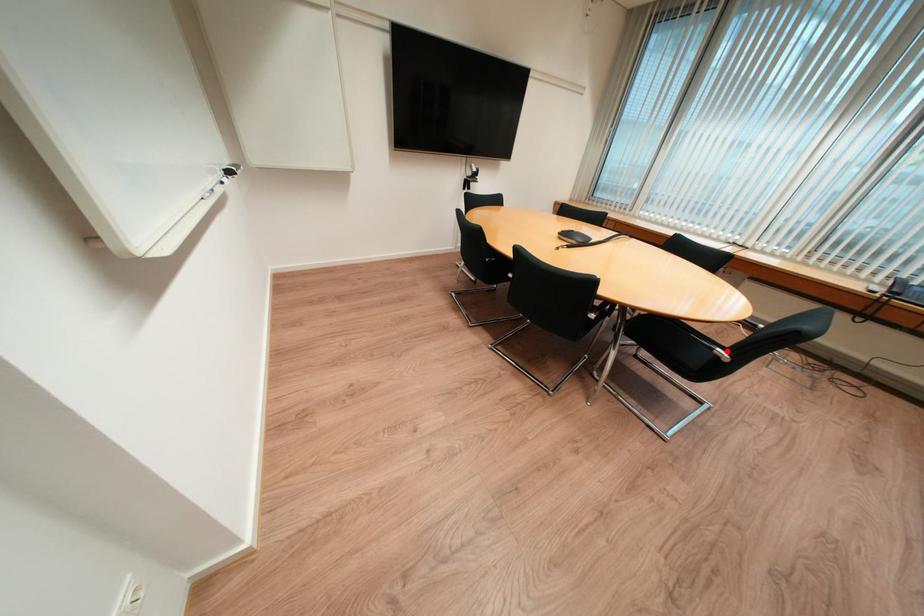
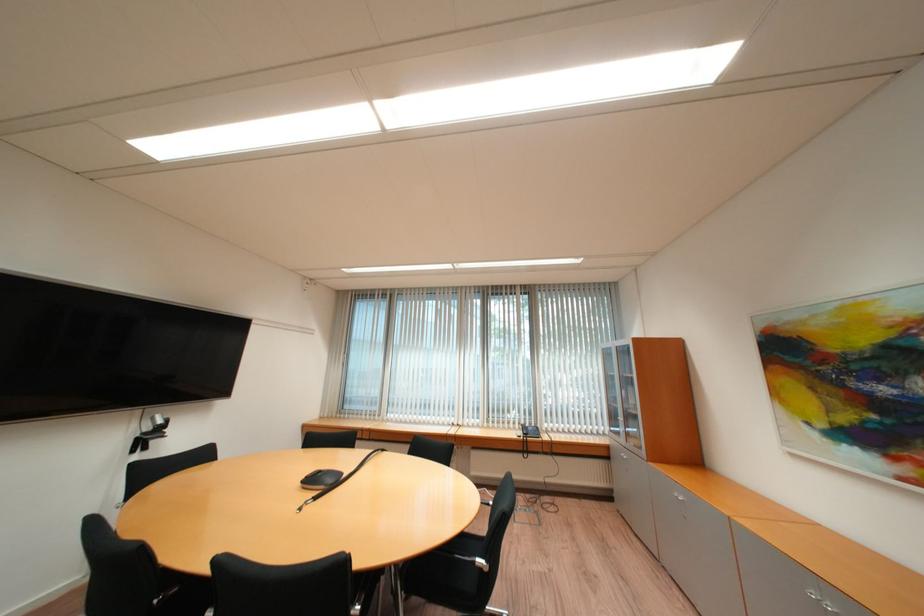
Question: I am providing you with two images of the same scene from different viewpoints. In image1, a red point is highlighted. Considering the same 3D point in image2, which of the following is correct?

Choices:
 (A) It is closer
 (B) It is farther

Answer: (A)